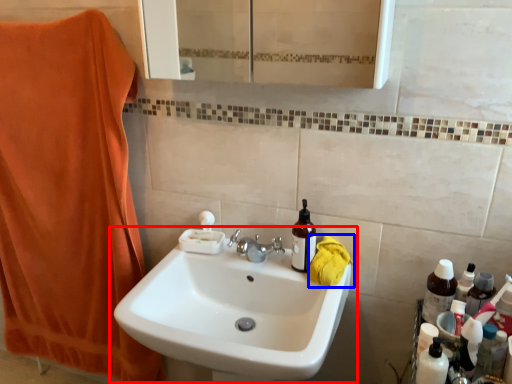
Question: Which point is closer to the camera, sink (highlighted by a red box) or beach towel (highlighted by a blue box)?

Choices:
 (A) sink
 (B) beach towel

Answer: (A)